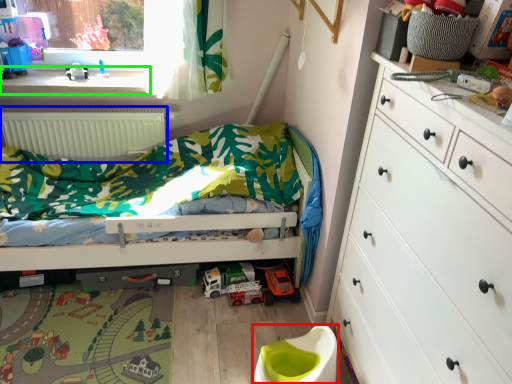
Question: Estimate the real-world distances between objects in this image. Which object is closer to toilet bowl (highlighted by a red box), radiator (highlighted by a blue box) or window sill (highlighted by a green box)?

Choices:
 (A) radiator
 (B) window sill

Answer: (A)